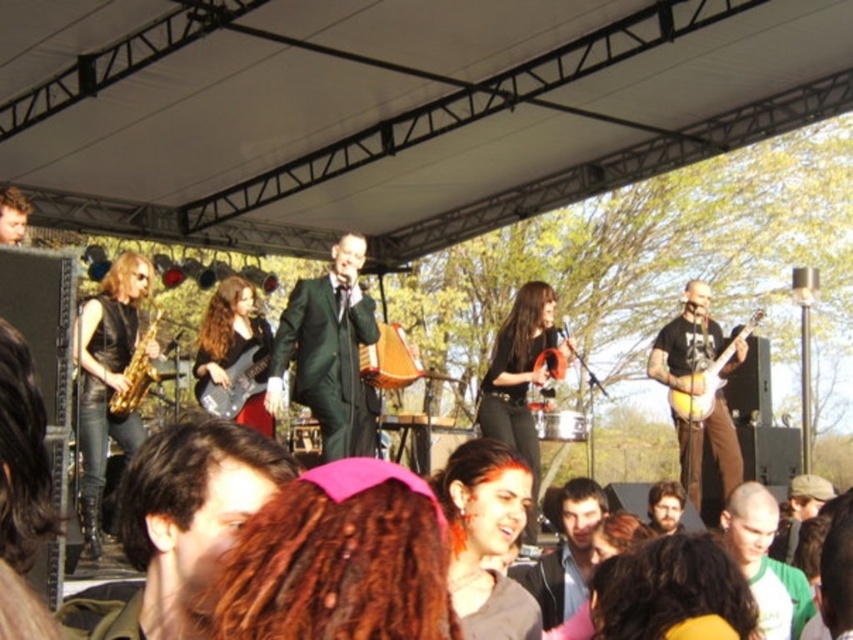
Which is above, matte pink hoodie at center or matte black electric guitar at center?

matte black electric guitar at center

Who is shorter, matte pink hoodie at center or matte black electric guitar at center?

Standing shorter between the two is matte black electric guitar at center.

Which is in front, point (454, 492) or point (247, 344)?

Point (454, 492) is in front.

Identify the location of matte pink hoodie at center. (486, 538).

Can you confirm if matte pink hoodie at center is taller than smooth brown hair at center?

In fact, matte pink hoodie at center may be shorter than smooth brown hair at center.

Is matte pink hoodie at center bigger than smooth brown hair at center?

Incorrect, matte pink hoodie at center is not larger than smooth brown hair at center.

Measure the distance between point (537,609) and camera.

10.70 meters

The width and height of the screenshot is (853, 640). What are the coordinates of `matte pink hoodie at center` in the screenshot? It's located at (486, 538).

Does light brown wood guitar at center appear under bald head at center?

Incorrect, light brown wood guitar at center is not positioned below bald head at center.

Who is taller, light brown wood guitar at center or bald head at center?

light brown wood guitar at center

Looking at this image, who is more forward, (x=657, y=348) or (x=798, y=634)?

Point (x=798, y=634)

This screenshot has height=640, width=853. I want to click on light brown wood guitar at center, so click(x=686, y=342).